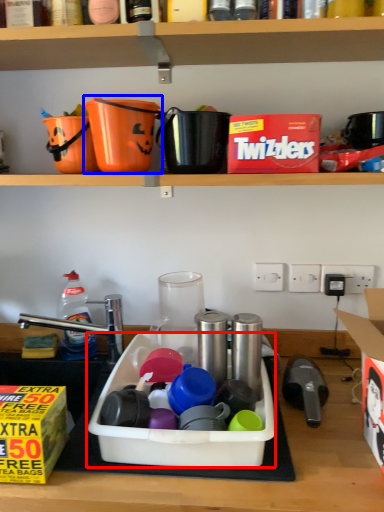
Question: Which object is further to the camera taking this photo, sink (highlighted by a red box) or appliance (highlighted by a blue box)?

Choices:
 (A) sink
 (B) appliance

Answer: (B)